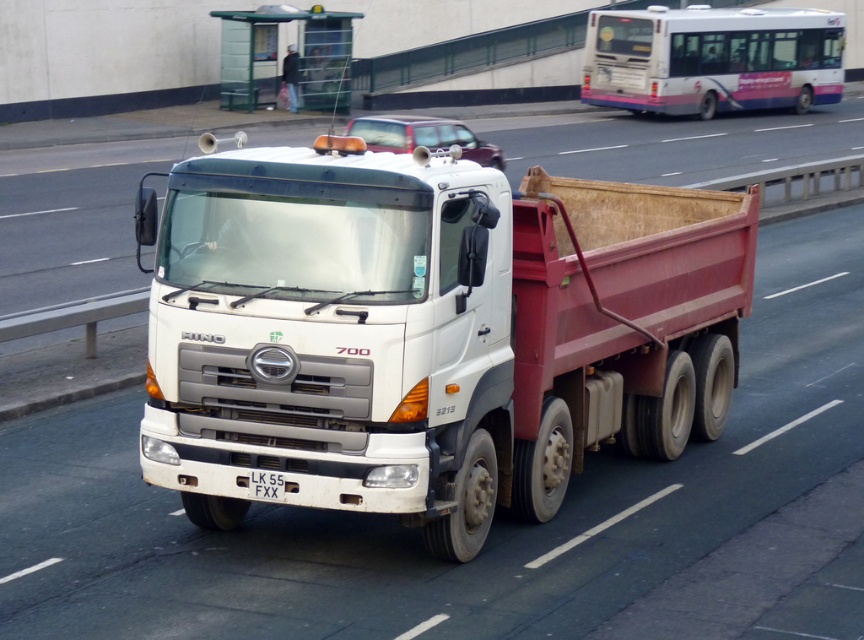
Question: Considering the real-world distances, which object is closest to the metallic red car at center?

Choices:
 (A) white matte truck at center
 (B) white plastic license plate at center

Answer: (B)

Question: Which object appears closest to the camera in this image?

Choices:
 (A) white plastic license plate at center
 (B) white matte truck at center

Answer: (A)

Question: Which object is positioned closest to the white matte truck at center?

Choices:
 (A) white plastic license plate at center
 (B) metallic red car at center

Answer: (A)

Question: In this image, where is white matte truck at center located relative to metallic red car at center?

Choices:
 (A) right
 (B) left

Answer: (A)

Question: Is white matte truck at center to the left of metallic red car at center from the viewer's perspective?

Choices:
 (A) no
 (B) yes

Answer: (A)

Question: Is white matte truck at center below metallic red car at center?

Choices:
 (A) yes
 (B) no

Answer: (A)